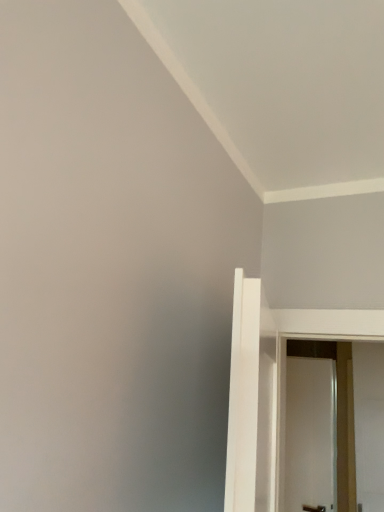
Find the location of a particular element. white glossy screen door at right is located at coordinates (310, 435).

This screenshot has width=384, height=512. What do you see at coordinates (310, 435) in the screenshot? I see `white glossy screen door at right` at bounding box center [310, 435].

Locate an element on the screen. white glossy screen door at right is located at coordinates (310, 435).